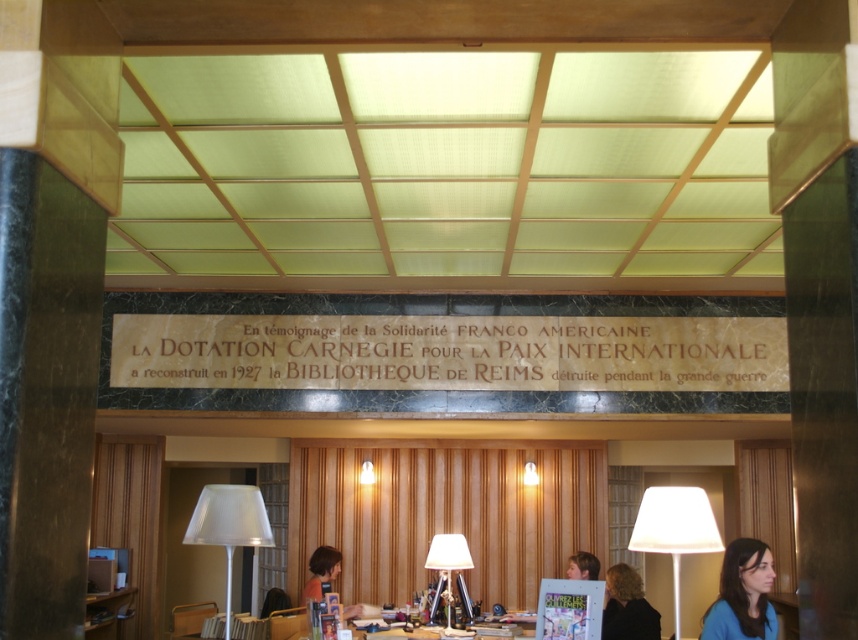
Who is higher up, white fabric lampshade at right or matte white lampshade at center?

Positioned higher is white fabric lampshade at right.

Does white fabric lampshade at right have a lesser width compared to matte white lampshade at center?

No.

Who is more distant from viewer, (674, 579) or (457, 536)?

The point (457, 536) is more distant.

This screenshot has height=640, width=858. What are the coordinates of `white fabric lampshade at right` in the screenshot? It's located at (675, 529).

Does white fabric lampshade at right have a smaller size compared to white translucent lampshade at lower left?

No, white fabric lampshade at right is not smaller than white translucent lampshade at lower left.

Consider the image. Does white fabric lampshade at right appear on the right side of white translucent lampshade at lower left?

Yes, white fabric lampshade at right is to the right of white translucent lampshade at lower left.

Image resolution: width=858 pixels, height=640 pixels. What do you see at coordinates (675, 529) in the screenshot?
I see `white fabric lampshade at right` at bounding box center [675, 529].

This screenshot has height=640, width=858. I want to click on white fabric lampshade at right, so click(x=675, y=529).

Is white fabric lampshade at right above blue matte shirt at lower right?

Incorrect, white fabric lampshade at right is not positioned above blue matte shirt at lower right.

Is white fabric lampshade at right bigger than blue matte shirt at lower right?

Indeed, white fabric lampshade at right has a larger size compared to blue matte shirt at lower right.

In order to click on white fabric lampshade at right in this screenshot , I will do `click(675, 529)`.